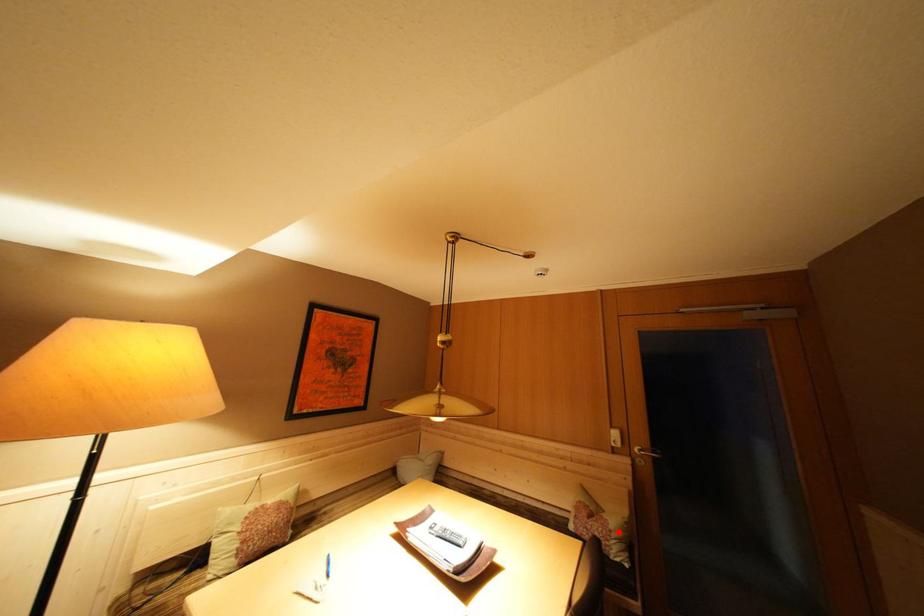
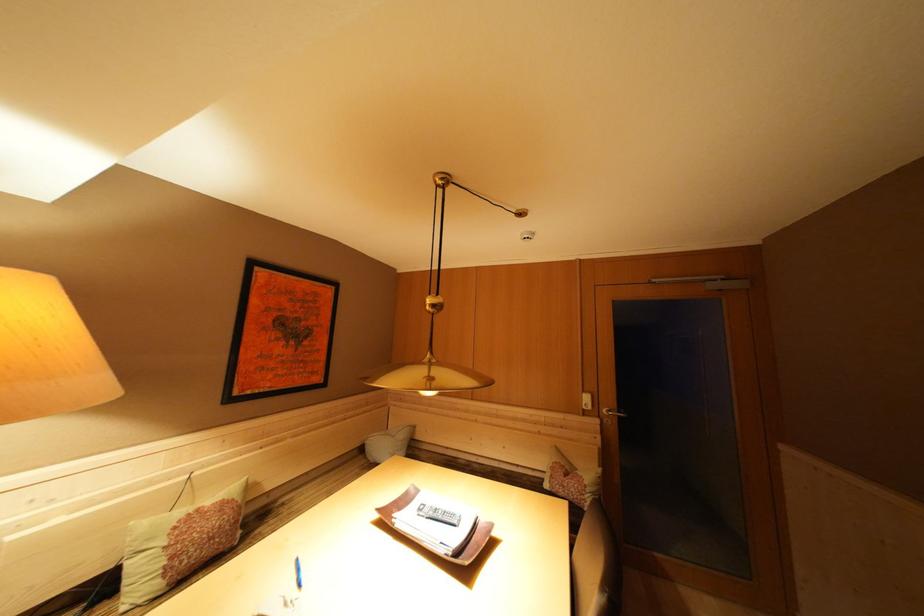
In the second image, find the point that corresponds to the highlighted location in the first image.

(592, 487)